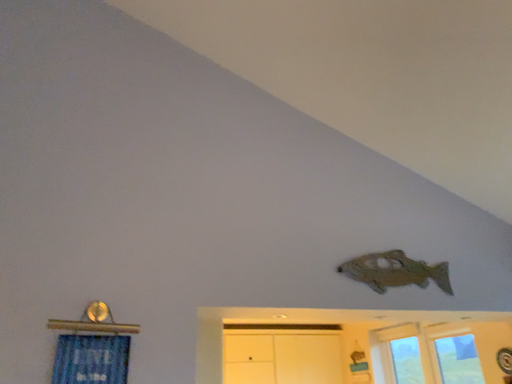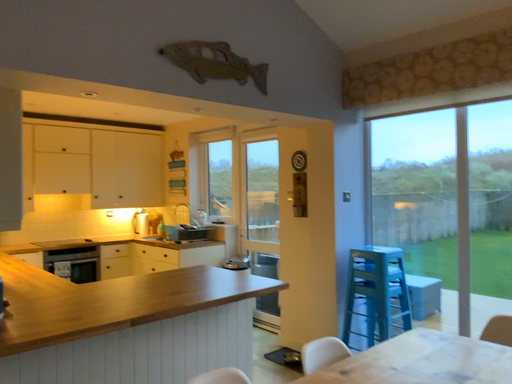
Question: Which way did the camera rotate in the video?

Choices:
 (A) rotated right
 (B) rotated left

Answer: (A)